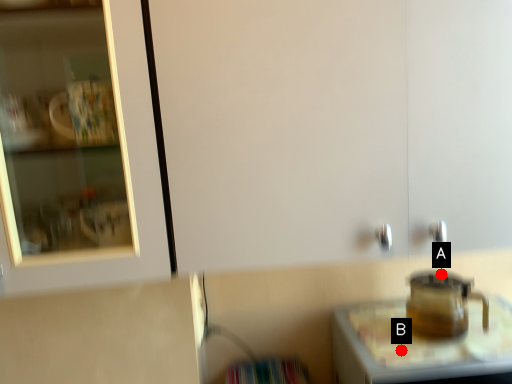
Question: Two points are circled on the image, labeled by A and B beside each circle. Which of the following is the farthest from the observer?

Choices:
 (A) A is further
 (B) B is further

Answer: (A)